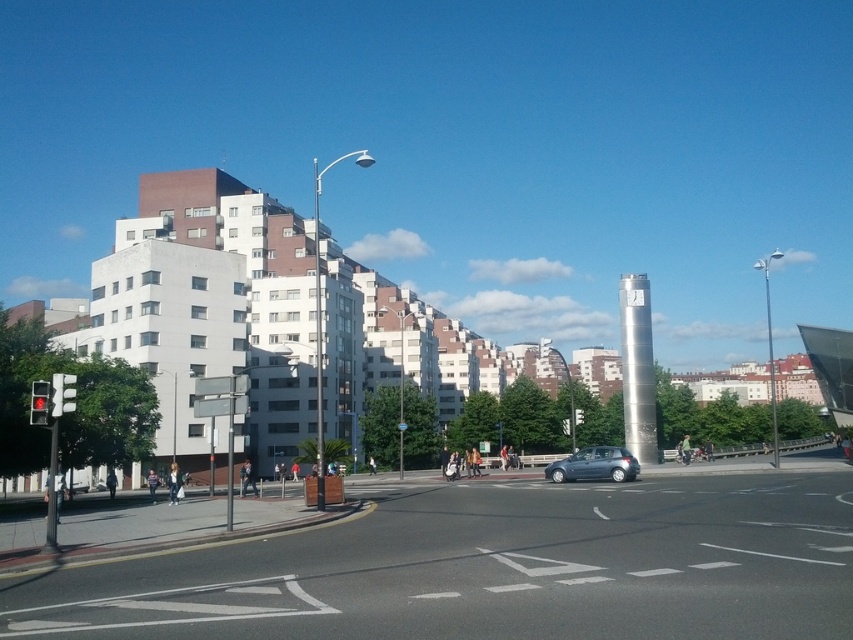
Question: Does matte black traffic light at left have a greater width compared to red glass traffic light at left?

Choices:
 (A) no
 (B) yes

Answer: (A)

Question: Which object is closer to the camera taking this photo?

Choices:
 (A) black asphalt road at lower center
 (B) red glass traffic light at left
 (C) satin silver hatchback at center

Answer: (A)

Question: Which of the following is the closest to the observer?

Choices:
 (A) (564, 474)
 (B) (49, 396)
 (C) (756, 531)
 (D) (68, 372)

Answer: (C)

Question: Among these points, which one is nearest to the camera?

Choices:
 (A) (303, 593)
 (B) (619, 472)
 (C) (62, 376)
 (D) (32, 417)

Answer: (A)

Question: From the image, what is the correct spatial relationship of black asphalt road at lower center in relation to satin silver hatchback at center?

Choices:
 (A) below
 (B) above

Answer: (B)

Question: Is matte black traffic light at left positioned before red glass traffic light at left?

Choices:
 (A) yes
 (B) no

Answer: (B)